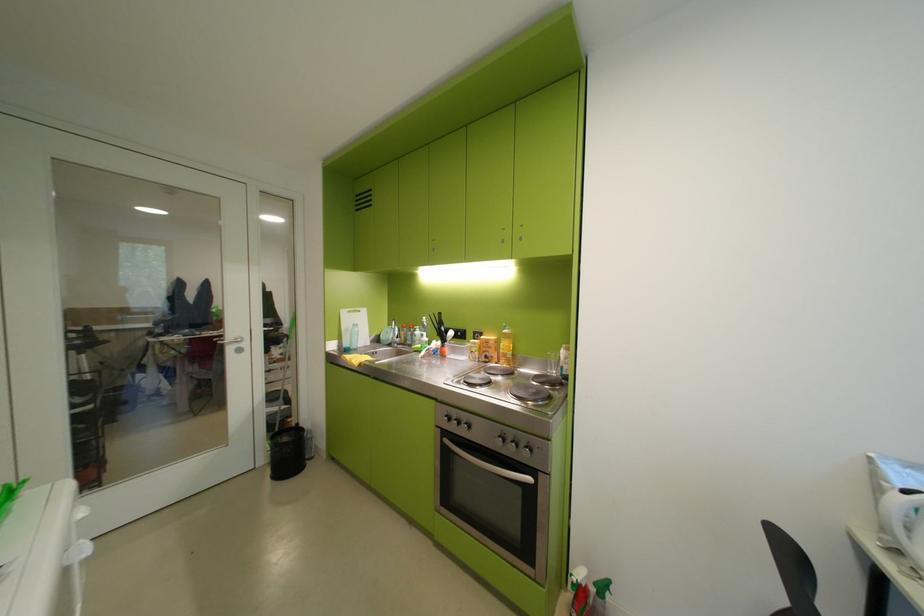
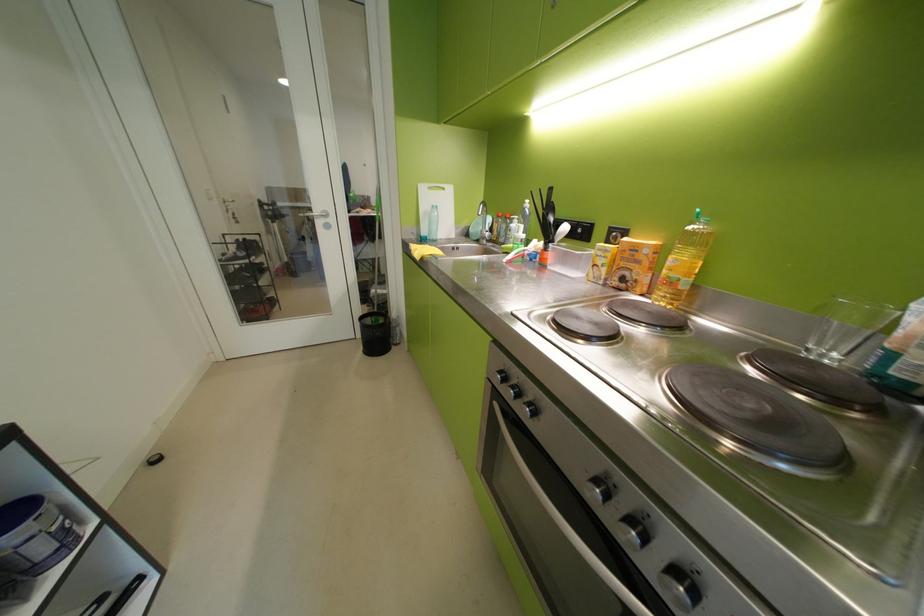
Where in the second image is the point corresponding to [497,342] from the first image?

(646, 249)